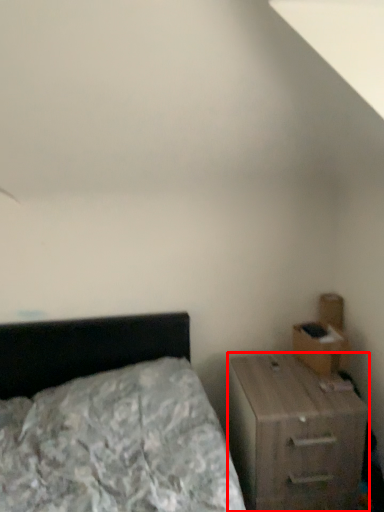
Question: Where is nightstand (annotated by the red box) located in relation to drawer in the image?

Choices:
 (A) left
 (B) right

Answer: (A)